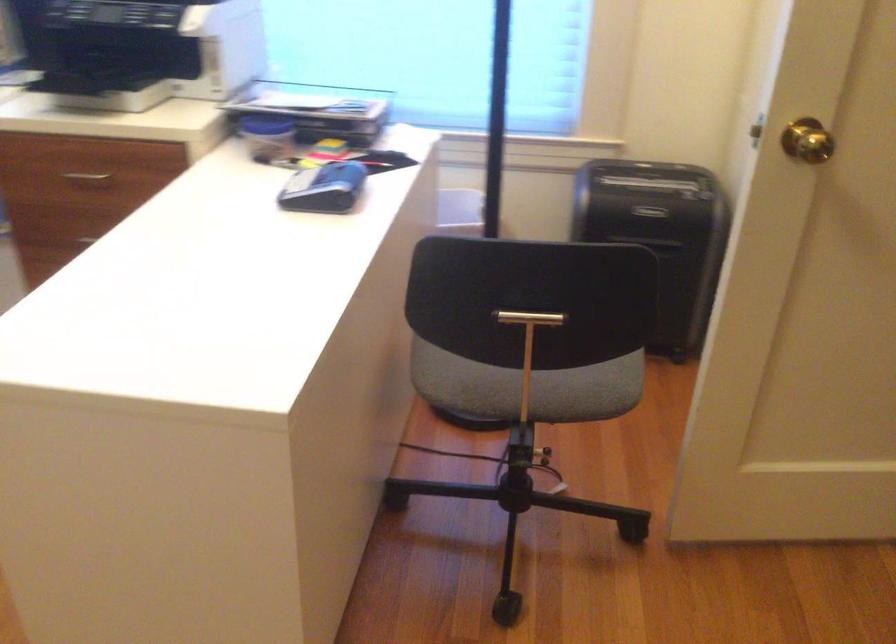
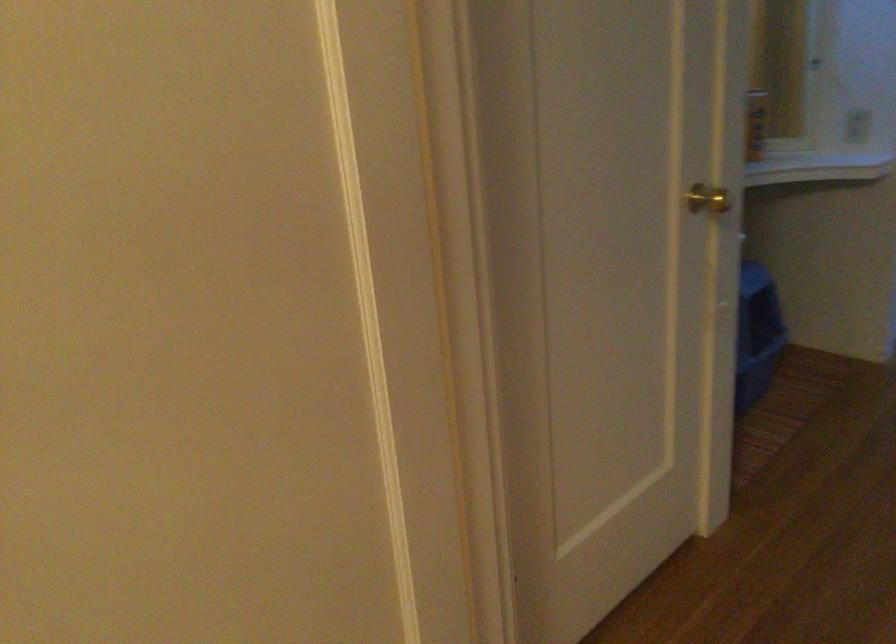
Question: The images are taken continuously from a first-person perspective. In which direction is your viewpoint rotating?

Choices:
 (A) Left
 (B) Right
 (C) Up
 (D) Down

Answer: (B)